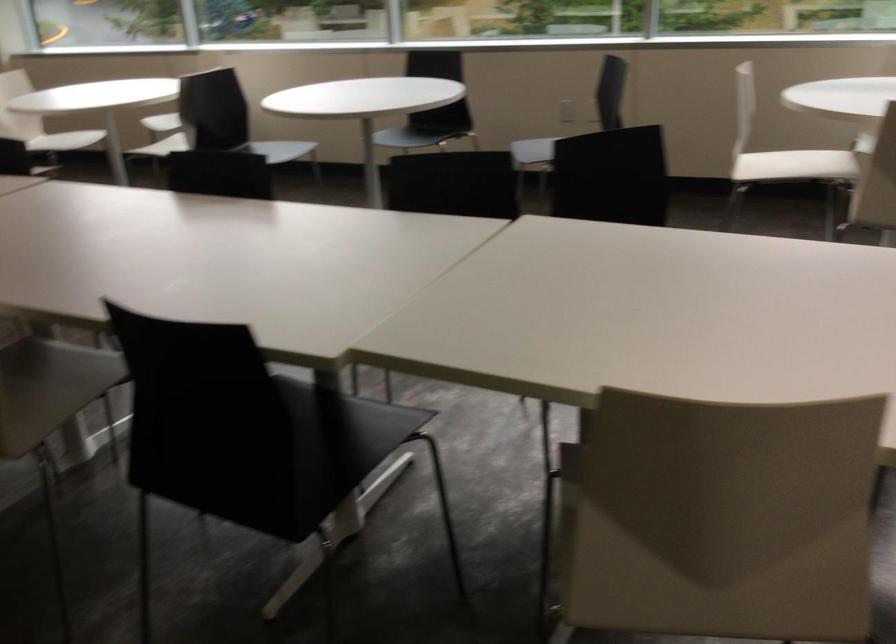
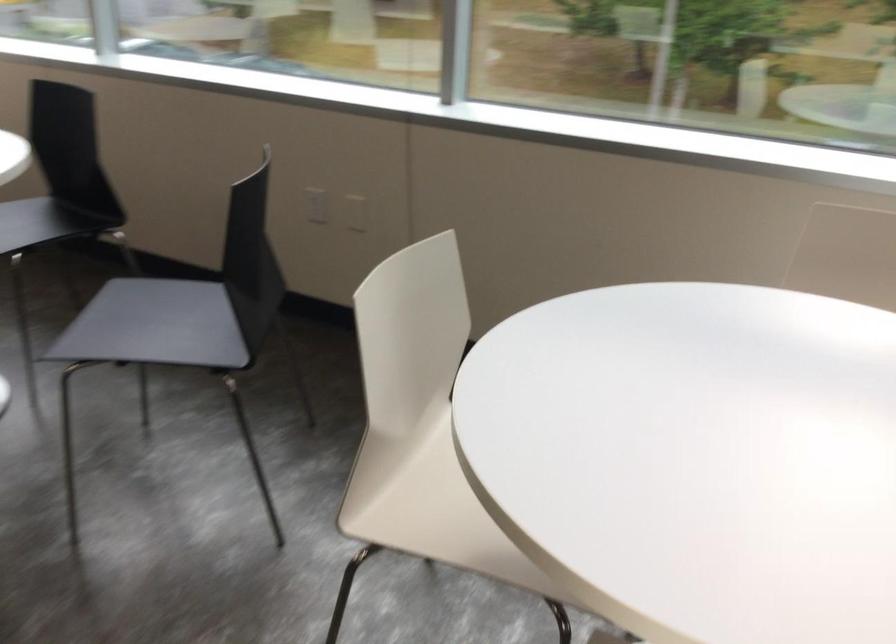
In a continuous first-person perspective shot, in which direction is the camera moving?

The movement direction of the cameraman is right, forward.